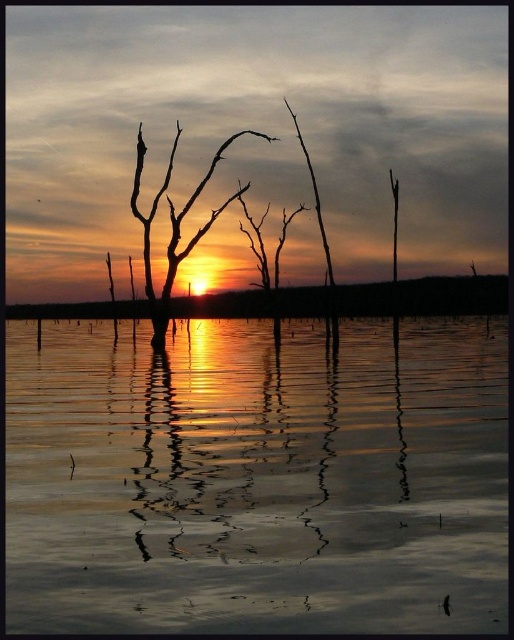
Measure the distance between point (433, 397) and camera.

A distance of 18.95 meters exists between point (433, 397) and camera.

Does smooth reflective water at center have a lesser width compared to silhouette wood at center?

No, smooth reflective water at center is not thinner than silhouette wood at center.

Who is more forward, (449, 616) or (318, 208)?

Positioned in front is point (449, 616).

Image resolution: width=514 pixels, height=640 pixels. In order to click on smooth reflective water at center in this screenshot , I will do `click(255, 480)`.

Which of these two, smooth reflective water at center or silhouette bare tree at center, stands shorter?

With less height is silhouette bare tree at center.

Is point (35, 513) behind point (169, 211)?

No.

Where is `smooth reflective water at center`? This screenshot has height=640, width=514. smooth reflective water at center is located at coordinates (255, 480).

Can you confirm if silhouette bare tree at center is smaller than silhouette wood at center?

Correct, silhouette bare tree at center occupies less space than silhouette wood at center.

Is the position of silhouette bare tree at center less distant than that of silhouette wood at center?

That is True.

You are a GUI agent. You are given a task and a screenshot of the screen. Output one action in this format:
    pyautogui.click(x=<x>, y=<y>)
    Task: Click on the silhouette bare tree at center
    This screenshot has width=514, height=640.
    Given the screenshot: What is the action you would take?
    pyautogui.click(x=174, y=227)

Where is `silhouette bare tree at center`? silhouette bare tree at center is located at coordinates (174, 227).